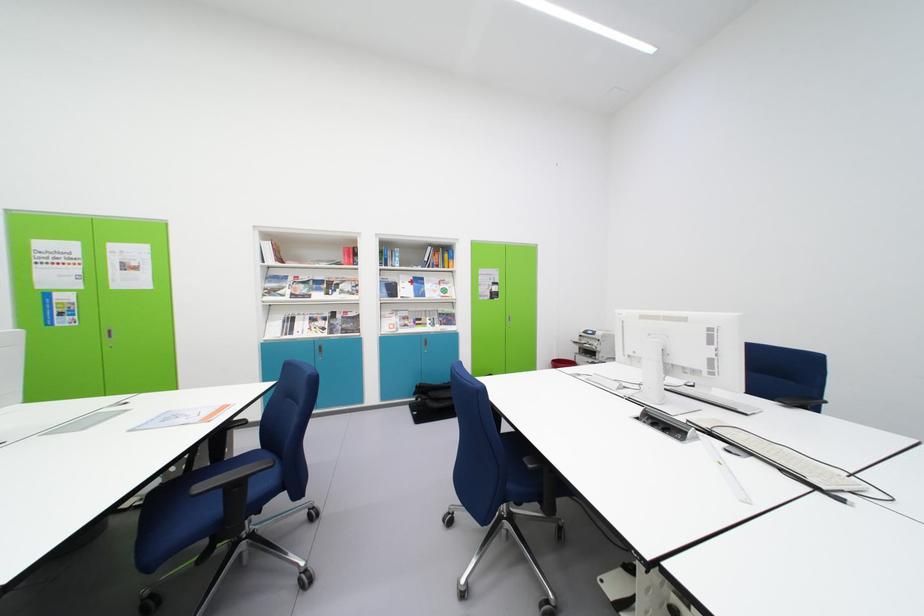
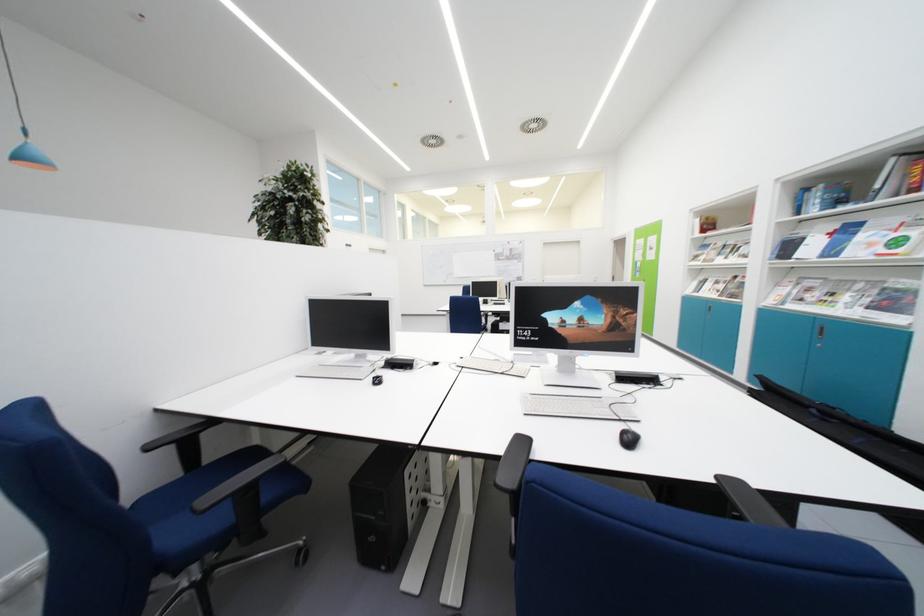
Question: I am providing you with two images of the same scene from different viewpoints. After the viewpoint changes to image2, which objects are now occluded?

Choices:
 (A) drum stool sitting surface
 (B) blue chair armrest
 (C) book on shelf
 (D) black laptop bag

Answer: (D)